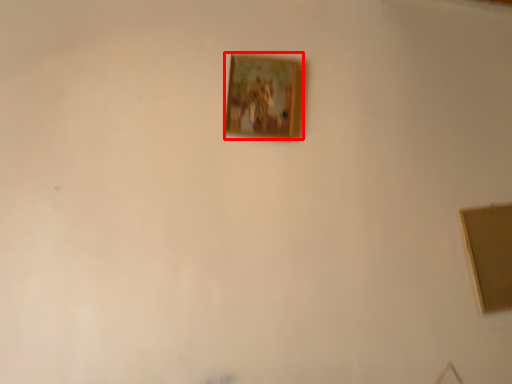
Question: From the image's perspective, where is picture frame (annotated by the red box) located in relation to picture frame in the image?

Choices:
 (A) above
 (B) below

Answer: (A)